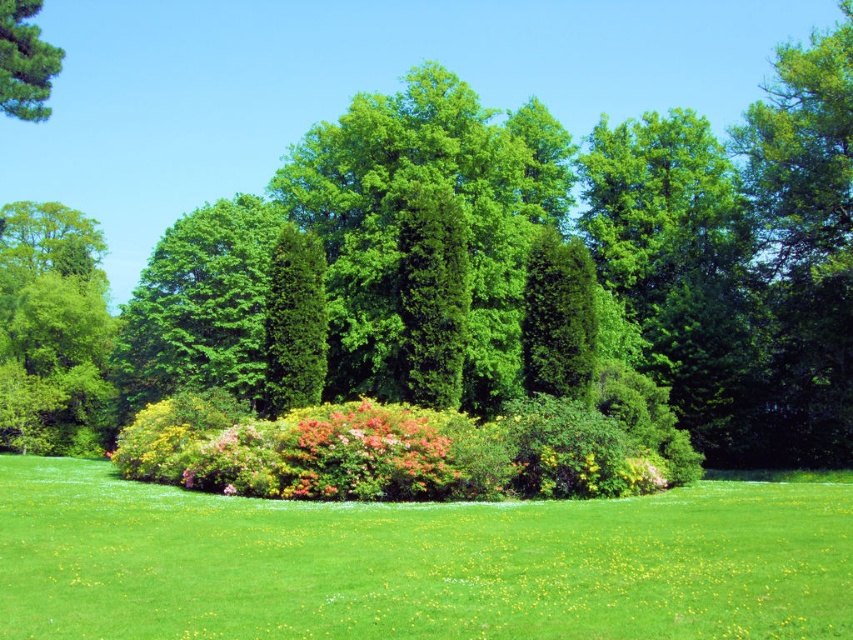
You are a gardener planning to plant a new flower bed. You observe the vivid pink petals at center and the green matte tree at upper left in the garden. Which object is positioned lower in the scene?

The vivid pink petals at center is located below the green matte tree at upper left, so it is positioned lower in the scene.

You are a gardener who wants to plant a new flower that requires full sunlight. You have two options in the garden scene shown. Which object would you choose to place the new flower near, the vivid pink petals at center or the green matte tree at upper left, and why?

The gardener should choose to plant the new flower near the vivid pink petals at center because it is not as tall as the green matte tree at upper left. Since the pink petals are shorter, they will cast less shade, allowing the new flower to receive sufficient full sunlight.